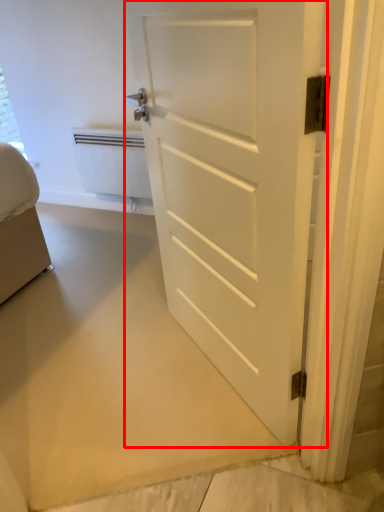
Question: From the image's perspective, what is the correct spatial positioning of door (annotated by the red box) in reference to radiator?

Choices:
 (A) above
 (B) below

Answer: (B)